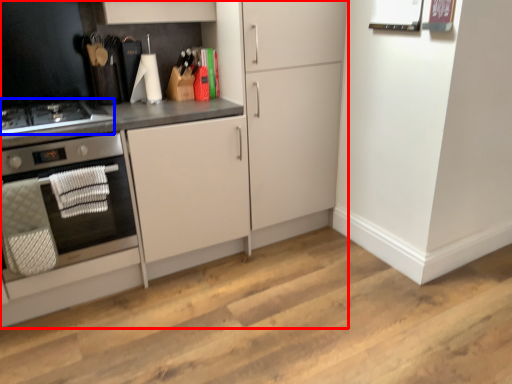
Question: Which object appears farthest to the camera in this image, cabinetry (highlighted by a red box) or gas stove (highlighted by a blue box)?

Choices:
 (A) cabinetry
 (B) gas stove

Answer: (B)